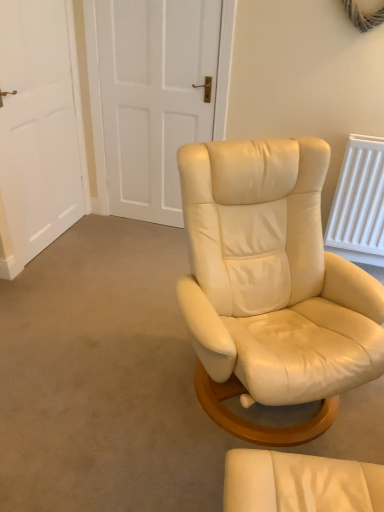
What do you see at coordinates (39, 130) in the screenshot?
I see `white matte door at upper left, acting as the second door starting from the right` at bounding box center [39, 130].

At what (x,y) coordinates should I click in order to perform the action: click on white matte door at upper left, which is counted as the 1th door, starting from the left. Please return your answer as a coordinate pair (x, y). The image size is (384, 512). Looking at the image, I should click on (39, 130).

Where is `matte cream leather chair at center`? matte cream leather chair at center is located at coordinates (300, 483).

Considering their positions, is white matte door at upper left, which is counted as the 1th door, starting from the left, located in front of or behind white matte door at upper center, acting as the 2th door starting from the left?

In the image, white matte door at upper left, which is counted as the 1th door, starting from the left, appears in front of white matte door at upper center, acting as the 2th door starting from the left.

Is point (55, 60) farther from viewer compared to point (148, 170)?

No, it is not.

Is white matte door at upper left, acting as the second door starting from the right, with white matte door at upper center, the first door positioned from the right?

No, white matte door at upper left, acting as the second door starting from the right, is not in contact with white matte door at upper center, the first door positioned from the right.

From a real-world perspective, is white matte door at upper left, acting as the second door starting from the right, on top of white matte door at upper center, acting as the 2th door starting from the left?

Incorrect, from a real-world perspective, white matte door at upper left, acting as the second door starting from the right, is lower than white matte door at upper center, acting as the 2th door starting from the left.

Does matte cream leather chair at center have a smaller size compared to white matte door at upper center, the first door positioned from the right?

Yes, matte cream leather chair at center is smaller than white matte door at upper center, the first door positioned from the right.

Between matte cream leather chair at center and white matte door at upper center, the first door positioned from the right, which one has smaller width?

white matte door at upper center, the first door positioned from the right.

Which object is further away from the camera, matte cream leather chair at center or white matte door at upper center, the first door positioned from the right?

white matte door at upper center, the first door positioned from the right.

Between point (309, 488) and point (139, 86), which one is positioned behind?

The point (139, 86) is more distant.

Are white matte door at upper center, acting as the 2th door starting from the left, and white matte door at upper left, which is counted as the 1th door, starting from the left, located far from each other?

white matte door at upper center, acting as the 2th door starting from the left, is near white matte door at upper left, which is counted as the 1th door, starting from the left, not far away.

Looking at this image, considering the relative sizes of white matte door at upper center, the first door positioned from the right, and white matte door at upper left, which is counted as the 1th door, starting from the left, in the image provided, is white matte door at upper center, the first door positioned from the right, smaller than white matte door at upper left, which is counted as the 1th door, starting from the left,?

No, white matte door at upper center, the first door positioned from the right, is not smaller than white matte door at upper left, which is counted as the 1th door, starting from the left.

Consider the image. Do you think white matte door at upper center, acting as the 2th door starting from the left, is within white matte door at upper left, acting as the second door starting from the right, or outside of it?

white matte door at upper center, acting as the 2th door starting from the left, is outside white matte door at upper left, acting as the second door starting from the right.

How distant is white matte door at upper center, acting as the 2th door starting from the left, from white matte door at upper left, acting as the second door starting from the right?

white matte door at upper center, acting as the 2th door starting from the left, and white matte door at upper left, acting as the second door starting from the right, are 20.14 inches apart from each other.

The width and height of the screenshot is (384, 512). Find the location of `chair below the white matte door at upper center, the first door positioned from the right (from a real-world perspective)`. chair below the white matte door at upper center, the first door positioned from the right (from a real-world perspective) is located at coordinates (300, 483).

Between white matte door at upper center, acting as the 2th door starting from the left, and matte cream leather chair at center, which one appears on the left side from the viewer's perspective?

From the viewer's perspective, white matte door at upper center, acting as the 2th door starting from the left, appears more on the left side.

Is white matte door at upper center, the first door positioned from the right, turned away from matte cream leather chair at center?

No, white matte door at upper center, the first door positioned from the right, is not facing away from matte cream leather chair at center.

From a real-world perspective, is white matte door at upper center, the first door positioned from the right, located beneath matte cream leather chair at center?

No, from a real-world perspective, white matte door at upper center, the first door positioned from the right, is not below matte cream leather chair at center.

Between white matte door at upper left, which is counted as the 1th door, starting from the left, and matte cream leather chair at center, which one is positioned in front?

matte cream leather chair at center.

In the scene shown: Can you tell me how much white matte door at upper left, which is counted as the 1th door, starting from the left, and matte cream leather chair at center differ in facing direction?

The facing directions of white matte door at upper left, which is counted as the 1th door, starting from the left, and matte cream leather chair at center are 80.6 degrees apart.

Identify the location of door that is the 1st object above the matte cream leather chair at center (from a real-world perspective). The width and height of the screenshot is (384, 512). (39, 130).

Is white matte door at upper left, acting as the second door starting from the right, touching matte cream leather chair at center?

white matte door at upper left, acting as the second door starting from the right, is not next to matte cream leather chair at center, and they're not touching.

Could white matte door at upper left, acting as the second door starting from the right, be considered to be inside matte cream leather chair at center?

Actually, white matte door at upper left, acting as the second door starting from the right, is outside matte cream leather chair at center.

Can you confirm if matte cream leather chair at center is positioned to the left of white matte door at upper left, acting as the second door starting from the right?

Incorrect, matte cream leather chair at center is not on the left side of white matte door at upper left, acting as the second door starting from the right.

Consider the image. From the image's perspective, would you say matte cream leather chair at center is shown under white matte door at upper left, which is counted as the 1th door, starting from the left?

Yes, from the image's perspective, matte cream leather chair at center is beneath white matte door at upper left, which is counted as the 1th door, starting from the left.

What are the coordinates of `door lying in front of the white matte door at upper center, the first door positioned from the right` in the screenshot? It's located at (39, 130).

The height and width of the screenshot is (512, 384). I want to click on the 2nd door positioned above the matte cream leather chair at center (from a real-world perspective), so click(x=154, y=97).

Considering their positions, is white matte door at upper center, the first door positioned from the right, positioned closer to matte cream leather chair at center than white matte door at upper left, which is counted as the 1th door, starting from the left?

The object closer to matte cream leather chair at center is white matte door at upper left, which is counted as the 1th door, starting from the left.

Based on their spatial positions, is white matte door at upper center, acting as the 2th door starting from the left, or matte cream leather chair at center further from white matte door at upper left, which is counted as the 1th door, starting from the left?

matte cream leather chair at center is positioned further to the anchor white matte door at upper left, which is counted as the 1th door, starting from the left.

Based on their spatial positions, is white matte door at upper left, which is counted as the 1th door, starting from the left, or white matte door at upper center, acting as the 2th door starting from the left, closer to matte cream leather chair at center?

white matte door at upper left, which is counted as the 1th door, starting from the left.

When comparing their distances from white matte door at upper center, the first door positioned from the right, does white matte door at upper left, which is counted as the 1th door, starting from the left, or matte cream leather chair at center seem closer?

white matte door at upper left, which is counted as the 1th door, starting from the left.

Based on their spatial positions, is matte cream leather chair at center or white matte door at upper left, which is counted as the 1th door, starting from the left, closer to white matte door at upper center, acting as the 2th door starting from the left?

The object closer to white matte door at upper center, acting as the 2th door starting from the left, is white matte door at upper left, which is counted as the 1th door, starting from the left.

Estimate the real-world distances between objects in this image. Which object is closer to white matte door at upper left, acting as the second door starting from the right, matte cream leather chair at center or white matte door at upper center, the first door positioned from the right?

Among the two, white matte door at upper center, the first door positioned from the right, is located nearer to white matte door at upper left, acting as the second door starting from the right.

You are a GUI agent. You are given a task and a screenshot of the screen. Output one action in this format:
    pyautogui.click(x=<x>, y=<y>)
    Task: Click on the door that lies between white matte door at upper center, acting as the 2th door starting from the left, and matte cream leather chair at center from top to bottom
    The width and height of the screenshot is (384, 512).
    Given the screenshot: What is the action you would take?
    pyautogui.click(x=39, y=130)